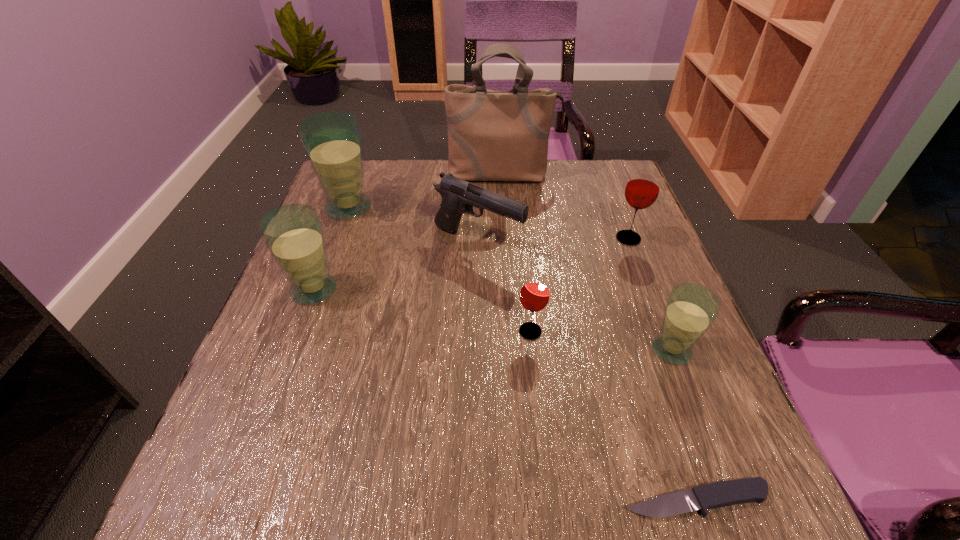
Find the location of a particular element. The image size is (960, 540). the smaller red glass is located at coordinates (534, 295).

Where is `the rightmost blue glass`? the rightmost blue glass is located at coordinates (691, 309).

The width and height of the screenshot is (960, 540). What are the coordinates of `the nearest blue glass` in the screenshot? It's located at (691, 309).

I want to click on steak knife, so click(x=726, y=493).

Where is `the shortest object`? The width and height of the screenshot is (960, 540). the shortest object is located at coordinates (726, 493).

At what (x,y) coordinates should I click in order to perform the action: click on free region located 0.260m on the front-facing side of the shoulder bag. Please return your answer as a coordinate pair (x, y). This screenshot has height=540, width=960. Looking at the image, I should click on (508, 250).

Locate an element on the screen. blank area located on the back of the farthest glass is located at coordinates (358, 183).

What are the coordinates of `vacant space located on the front of the fourth nearest glass` in the screenshot? It's located at (665, 334).

Locate an element on the screen. free space located 0.150m on the back of the second biggest blue glass is located at coordinates (337, 230).

Where is `blank space located at the muzzle of the black gun`? The image size is (960, 540). blank space located at the muzzle of the black gun is located at coordinates point(557,243).